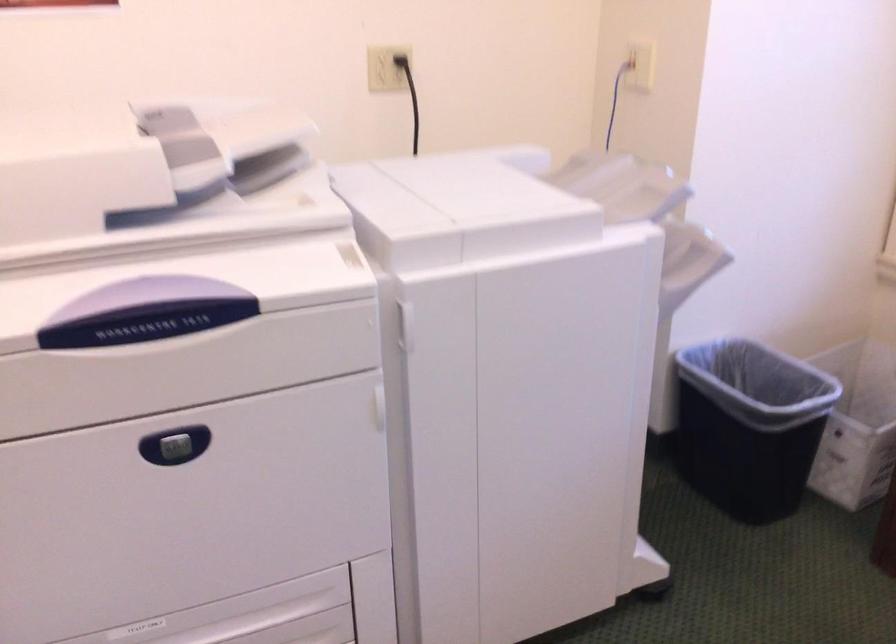
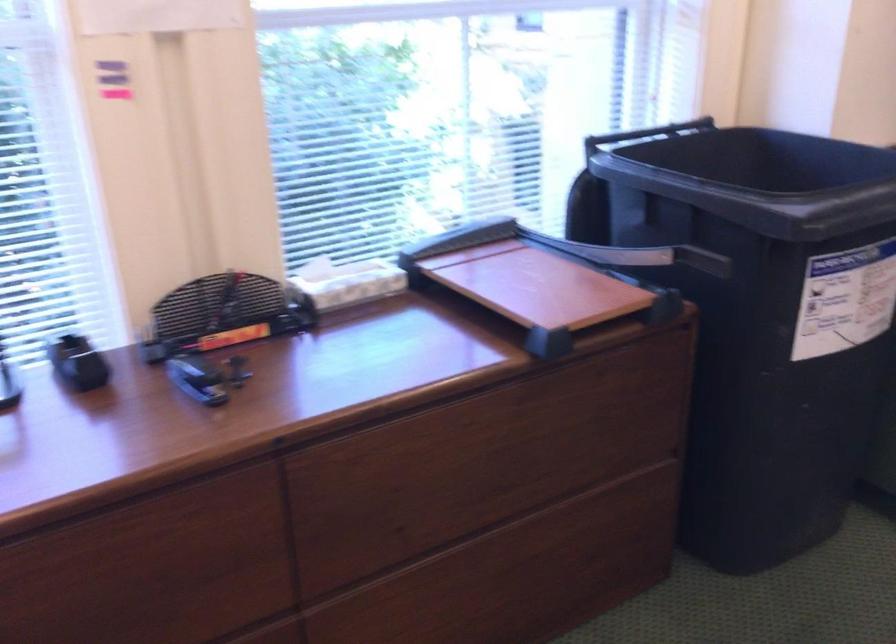
How did the camera likely rotate?

The rotation direction of the camera is right-down.